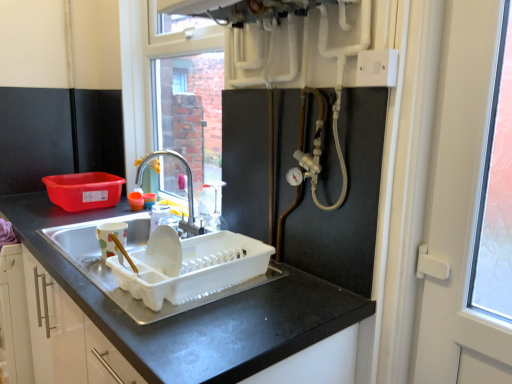
You are a GUI agent. You are given a task and a screenshot of the screen. Output one action in this format:
    pyautogui.click(x=<x>, y=<y>)
    Task: Click on the vacant area that lies in front of white plastic dish rack at sink, the 1th appliance when ordered from right to left
    The height and width of the screenshot is (384, 512).
    Given the screenshot: What is the action you would take?
    pyautogui.click(x=203, y=330)